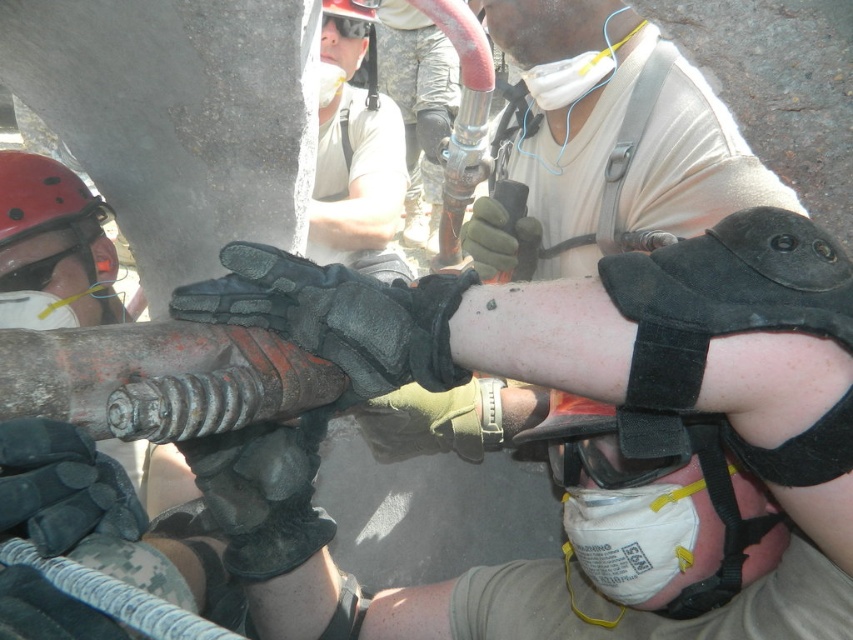
Question: Can you confirm if red matte helmet at left is positioned to the left of black leather gloves at center?

Choices:
 (A) no
 (B) yes

Answer: (B)

Question: Is red matte helmet at left wider than black leather gloves at center?

Choices:
 (A) no
 (B) yes

Answer: (B)

Question: Is red matte helmet at left further to camera compared to black leather gloves at center?

Choices:
 (A) no
 (B) yes

Answer: (A)

Question: Which of the following is the closest to the observer?

Choices:
 (A) (525, 220)
 (B) (120, 305)

Answer: (A)

Question: Which point is closer to the camera?

Choices:
 (A) black leather gloves at center
 (B) red matte helmet at left

Answer: (B)